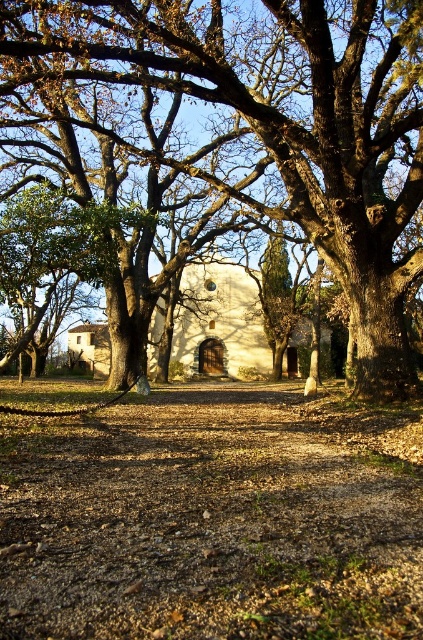
Question: Among these objects, which one is nearest to the camera?

Choices:
 (A) white stucco chapel at center
 (B) smooth brown oak tree at center

Answer: (B)

Question: Is smooth brown oak tree at center above white stucco chapel at center?

Choices:
 (A) no
 (B) yes

Answer: (B)

Question: Which of the following is the closest to the observer?

Choices:
 (A) smooth brown oak tree at center
 (B) white stucco chapel at center

Answer: (A)

Question: Does smooth brown oak tree at center have a lesser width compared to white stucco chapel at center?

Choices:
 (A) yes
 (B) no

Answer: (A)

Question: Is smooth brown oak tree at center above white stucco chapel at center?

Choices:
 (A) yes
 (B) no

Answer: (A)